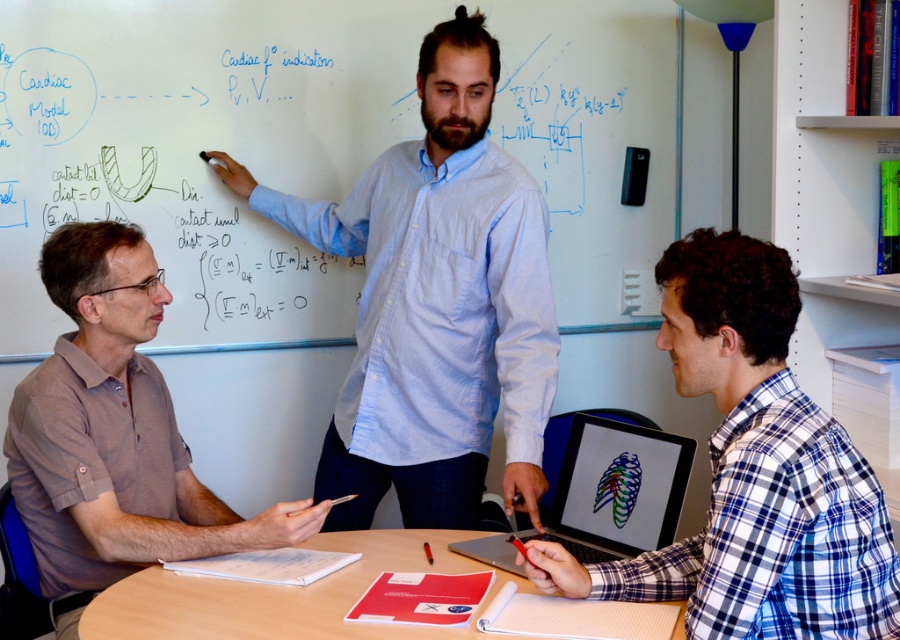
Between brown cotton shirt at left and smooth wooden table at center, which one is positioned higher?

brown cotton shirt at left

Measure the distance between brown cotton shirt at left and smooth wooden table at center.

The distance of brown cotton shirt at left from smooth wooden table at center is 12.25 inches.

Measure the distance between brown cotton shirt at left and camera.

brown cotton shirt at left and camera are 5.43 feet apart.

The width and height of the screenshot is (900, 640). Identify the location of brown cotton shirt at left. (115, 432).

Where is `blue plaid shirt at center`? This screenshot has height=640, width=900. blue plaid shirt at center is located at coordinates pos(753,472).

Consider the image. Is blue plaid shirt at center taller than smooth wooden table at center?

Yes.

Between point (829, 595) and point (140, 586), which one is positioned behind?

Point (140, 586)

Identify the location of blue plaid shirt at center. (753, 472).

Between whiteboard at upper center and light blue striped shirt at center, which one is positioned lower?

light blue striped shirt at center

Is point (57, 13) behind point (493, 170)?

Yes, it is behind point (493, 170).

Image resolution: width=900 pixels, height=640 pixels. I want to click on whiteboard at upper center, so click(198, 147).